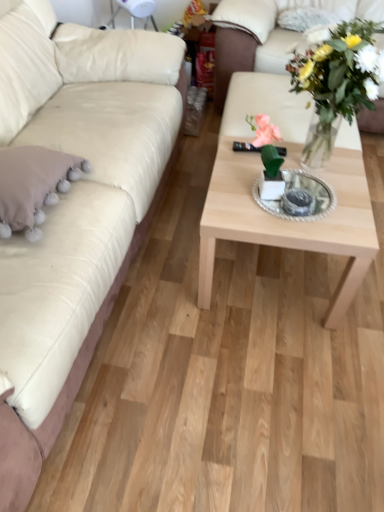
Question: Is natural wood coffee table at center further to the viewer compared to white leather studio couch at upper right, the first studio couch in the right-to-left sequence?

Choices:
 (A) no
 (B) yes

Answer: (A)

Question: From a real-world perspective, is natural wood coffee table at center over white leather studio couch at upper right, which ranks as the second studio couch in left-to-right order?

Choices:
 (A) yes
 (B) no

Answer: (B)

Question: Can you confirm if natural wood coffee table at center is taller than white leather studio couch at upper right, which ranks as the second studio couch in left-to-right order?

Choices:
 (A) yes
 (B) no

Answer: (B)

Question: Can you confirm if natural wood coffee table at center is bigger than white leather studio couch at upper right, which ranks as the second studio couch in left-to-right order?

Choices:
 (A) no
 (B) yes

Answer: (A)

Question: Is natural wood coffee table at center oriented towards white leather studio couch at upper right, the first studio couch in the right-to-left sequence?

Choices:
 (A) no
 (B) yes

Answer: (A)

Question: Does natural wood coffee table at center have a greater width compared to white leather studio couch at upper right, the first studio couch in the right-to-left sequence?

Choices:
 (A) yes
 (B) no

Answer: (B)

Question: Is fluffy white pillow at upper right, positioned as the 1th pillow in top-to-bottom order, at the left side of beige fabric pillow at left, the first pillow when ordered from bottom to top?

Choices:
 (A) yes
 (B) no

Answer: (B)

Question: Considering the relative positions of fluffy white pillow at upper right, acting as the first pillow starting from the back, and beige fabric pillow at left, which appears as the 2th pillow when viewed from the back, in the image provided, is fluffy white pillow at upper right, acting as the first pillow starting from the back, to the right of beige fabric pillow at left, which appears as the 2th pillow when viewed from the back, from the viewer's perspective?

Choices:
 (A) no
 (B) yes

Answer: (B)

Question: Is fluffy white pillow at upper right, the second pillow viewed from the left, not near beige fabric pillow at left, the second pillow positioned from the top?

Choices:
 (A) yes
 (B) no

Answer: (A)

Question: Considering the relative positions of fluffy white pillow at upper right, marked as the first pillow in a right-to-left arrangement, and beige fabric pillow at left, which is the 2th pillow from right to left, in the image provided, is fluffy white pillow at upper right, marked as the first pillow in a right-to-left arrangement, behind beige fabric pillow at left, which is the 2th pillow from right to left,?

Choices:
 (A) yes
 (B) no

Answer: (A)

Question: From a real-world perspective, is fluffy white pillow at upper right, the second pillow viewed from the left, physically above beige fabric pillow at left, which is the 2th pillow from right to left?

Choices:
 (A) no
 (B) yes

Answer: (B)

Question: Is fluffy white pillow at upper right, the 2th pillow when ordered from bottom to top, located outside beige fabric pillow at left, marked as the first pillow in a front-to-back arrangement?

Choices:
 (A) no
 (B) yes

Answer: (B)

Question: Is beige fabric pillow at left, which appears as the 2th pillow when viewed from the back, at the back of matte white couch at left, the 2th studio couch when ordered from right to left?

Choices:
 (A) no
 (B) yes

Answer: (B)